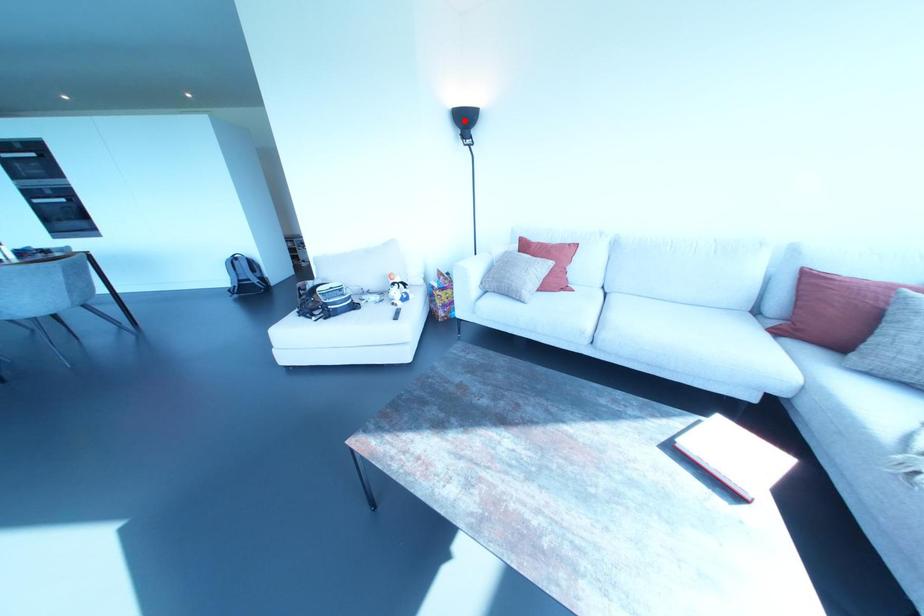
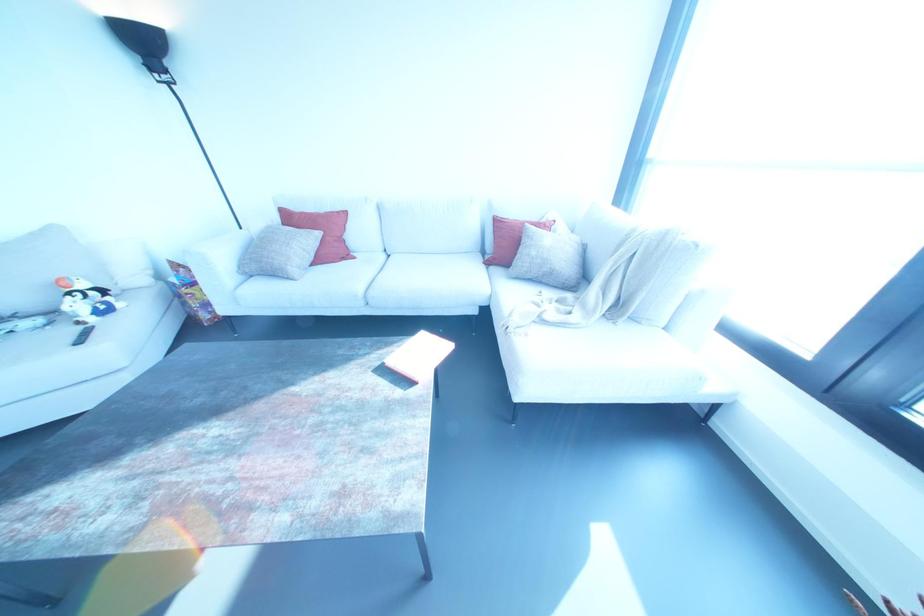
The point at the highlighted location is marked in the first image. Where is the corresponding point in the second image?

(142, 44)